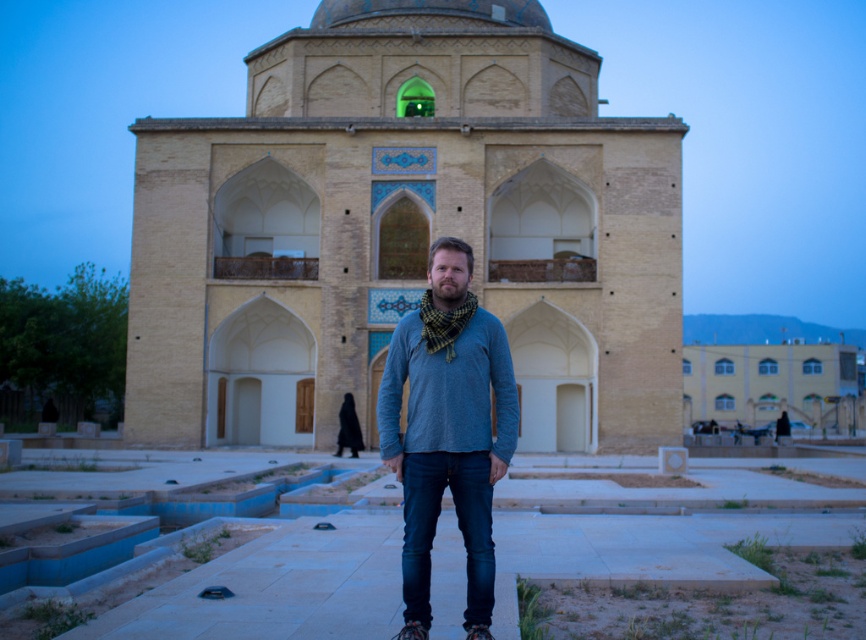
Question: Which object is positioned closest to the matte blue sweater at center?

Choices:
 (A) beige stone building at center
 (B) dark blue denim jeans at center

Answer: (B)

Question: Can you confirm if matte blue sweater at center is wider than dark blue denim jeans at center?

Choices:
 (A) no
 (B) yes

Answer: (B)

Question: Is blue cotton shirt at center positioned at the back of dark blue denim jeans at center?

Choices:
 (A) yes
 (B) no

Answer: (B)

Question: Which object is farther from the camera taking this photo?

Choices:
 (A) checkered wool scarf at center
 (B) matte blue sweater at center
 (C) beige stone building at center

Answer: (A)

Question: Is matte blue sweater at center wider than checkered wool scarf at center?

Choices:
 (A) no
 (B) yes

Answer: (B)

Question: Which object is closer to the camera taking this photo?

Choices:
 (A) matte blue sweater at center
 (B) beige stone building at center
 (C) blue cotton shirt at center

Answer: (C)